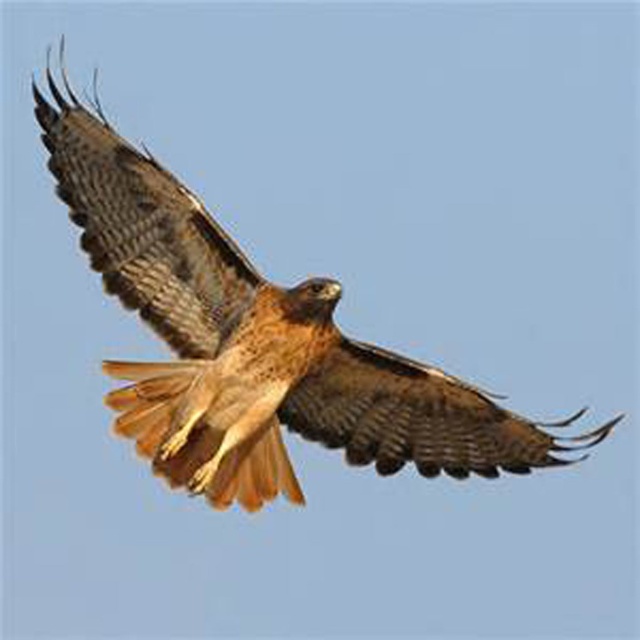
Does brown textured wing at upper left have a greater width compared to brown feathered wing at center?

Correct, the width of brown textured wing at upper left exceeds that of brown feathered wing at center.

Where is `brown textured wing at upper left`? The width and height of the screenshot is (640, 640). brown textured wing at upper left is located at coordinates (x=145, y=228).

Can you confirm if brown feathered eagle at center is taller than brown textured wing at upper left?

Yes.

Who is positioned more to the left, brown feathered eagle at center or brown textured wing at upper left?

From the viewer's perspective, brown textured wing at upper left appears more on the left side.

Identify the location of brown feathered eagle at center. The image size is (640, 640). (256, 346).

Find the location of a particular element. This screenshot has height=640, width=640. brown feathered eagle at center is located at coordinates (256, 346).

Is brown feathered eagle at center to the left of brown feathered wing at center from the viewer's perspective?

Indeed, brown feathered eagle at center is positioned on the left side of brown feathered wing at center.

Between brown feathered eagle at center and brown feathered wing at center, which one is positioned lower?

brown feathered wing at center is lower down.

You are a GUI agent. You are given a task and a screenshot of the screen. Output one action in this format:
    pyautogui.click(x=<x>, y=<y>)
    Task: Click on the brown feathered eagle at center
    This screenshot has height=640, width=640.
    Given the screenshot: What is the action you would take?
    pyautogui.click(x=256, y=346)

This screenshot has height=640, width=640. I want to click on brown feathered eagle at center, so click(256, 346).